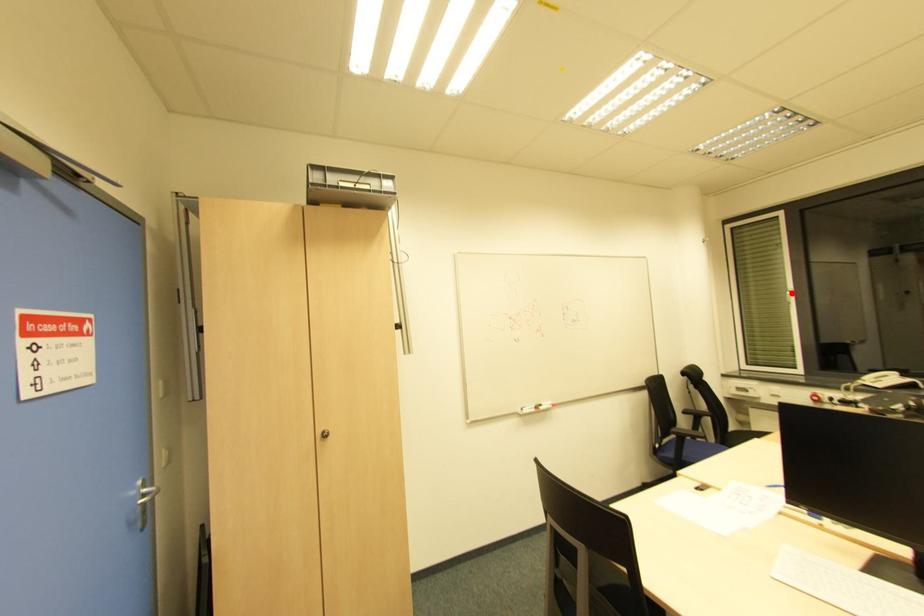
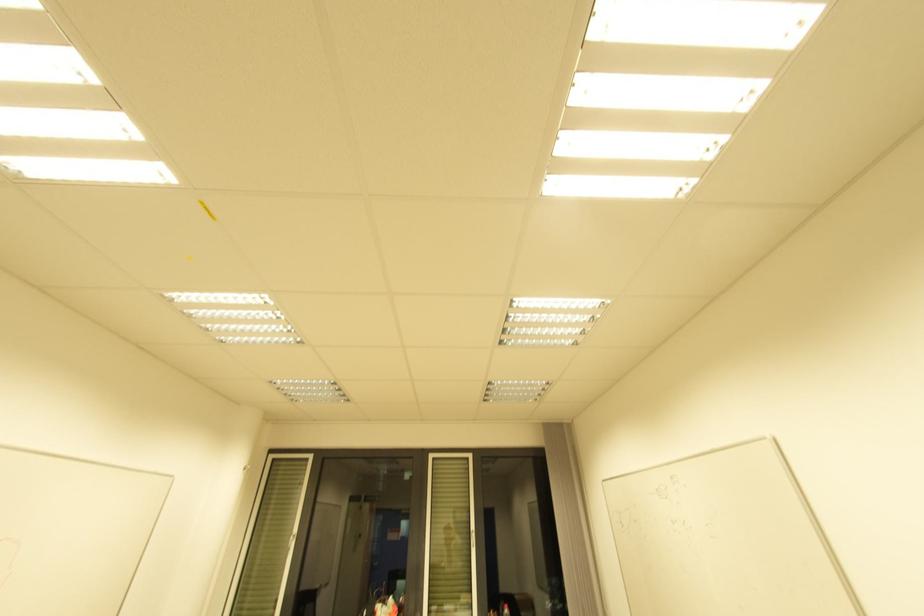
In the second image, find the point that corresponds to the highlighted location in the first image.

(294, 538)